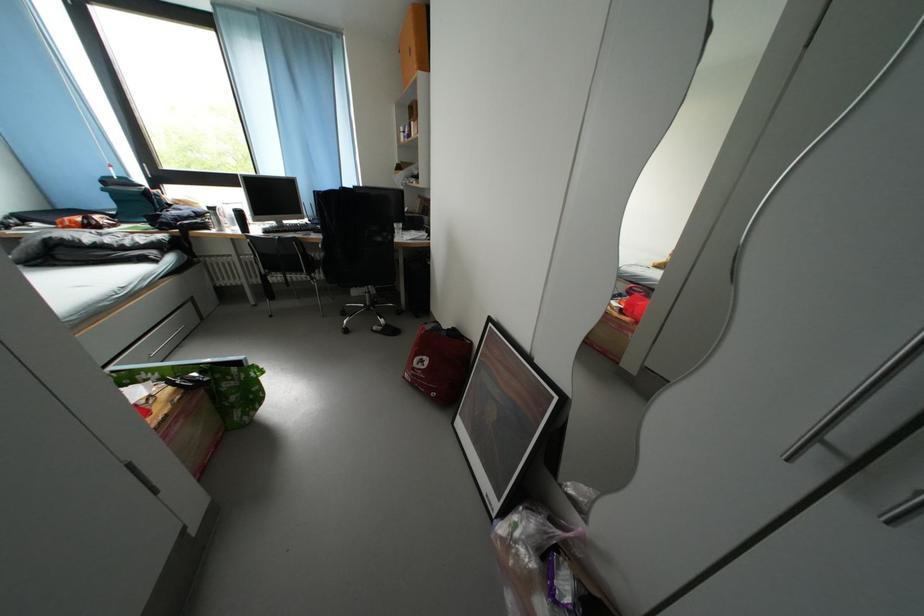
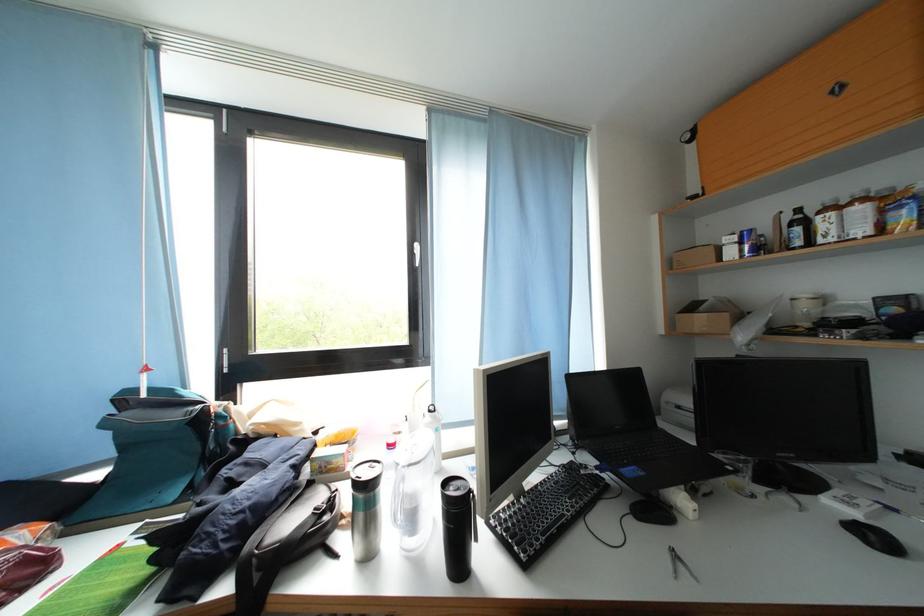
In the second image, find the point that corresponds to the point at 223,223 in the first image.

(369, 521)